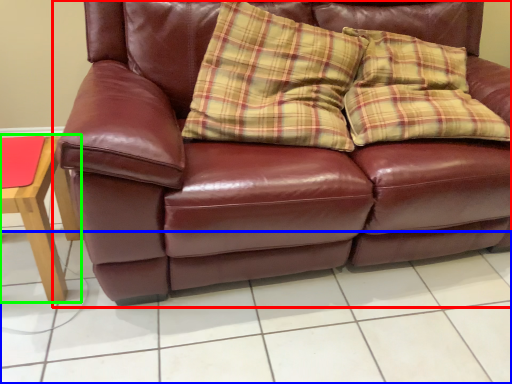
Question: Which is nearer to the studio couch (highlighted by a red box)? tile (highlighted by a blue box) or table (highlighted by a green box).

Choices:
 (A) tile
 (B) table

Answer: (A)